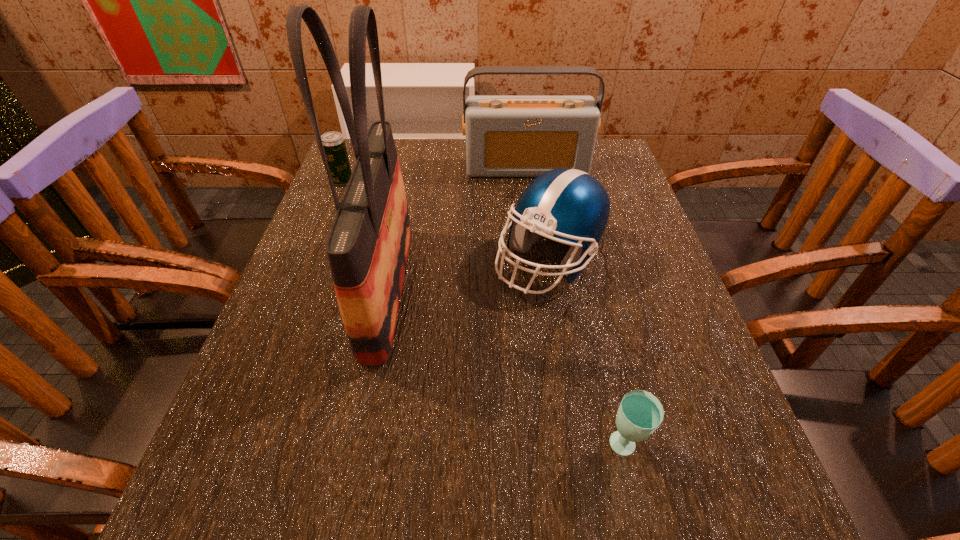
Where is `free point at the far edge`? This screenshot has width=960, height=540. free point at the far edge is located at coordinates (452, 178).

Locate an element on the screen. This screenshot has width=960, height=540. vacant space at the near edge of the desktop is located at coordinates (546, 511).

Identify the location of free location at the right edge of the desktop. (634, 257).

Locate an element on the screen. The image size is (960, 540). free spot at the far left corner of the desktop is located at coordinates [x=397, y=144].

Image resolution: width=960 pixels, height=540 pixels. I want to click on vacant area that lies between the glass and the third tallest object, so click(586, 354).

Identify the location of free space between the third tallest object and the beer can. (445, 221).

Where is `free spot between the nearest object and the football helmet`? Image resolution: width=960 pixels, height=540 pixels. free spot between the nearest object and the football helmet is located at coordinates (586, 354).

You are a GUI agent. You are given a task and a screenshot of the screen. Output one action in this format:
    pyautogui.click(x=<x>, y=<y>)
    Task: Click on the free point between the glass and the radio receiver
    This screenshot has width=960, height=540.
    Given the screenshot: What is the action you would take?
    pyautogui.click(x=575, y=308)

Locate an element on the screen. The height and width of the screenshot is (540, 960). empty location between the tallest object and the fourth shortest object is located at coordinates (457, 228).

At what (x,y) coordinates should I click in order to perform the action: click on blank region between the leftmost object and the football helmet. Please return your answer as a coordinate pair (x, y). The height and width of the screenshot is (540, 960). Looking at the image, I should click on (445, 221).